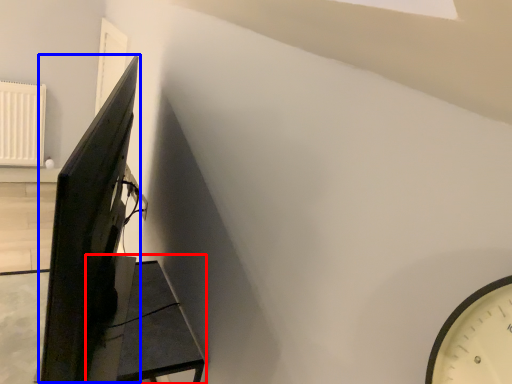
Question: Which of the following is the closest to the observer, furniture (highlighted by a red box) or computer monitor (highlighted by a blue box)?

Choices:
 (A) furniture
 (B) computer monitor

Answer: (B)